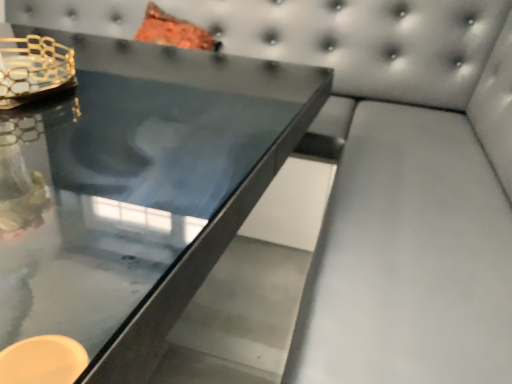
Question: Is glossy glass table at center in front of gold mesh candle holder at upper left?

Choices:
 (A) yes
 (B) no

Answer: (A)

Question: Can you confirm if glossy glass table at center is positioned to the left of gold mesh candle holder at upper left?

Choices:
 (A) no
 (B) yes

Answer: (A)

Question: From the image's perspective, is glossy glass table at center located above gold mesh candle holder at upper left?

Choices:
 (A) yes
 (B) no

Answer: (B)

Question: Does glossy glass table at center have a smaller size compared to gold mesh candle holder at upper left?

Choices:
 (A) no
 (B) yes

Answer: (A)

Question: Would you say glossy glass table at center is outside gold mesh candle holder at upper left?

Choices:
 (A) yes
 (B) no

Answer: (A)

Question: Is glossy glass table at center next to gold mesh candle holder at upper left and touching it?

Choices:
 (A) yes
 (B) no

Answer: (B)

Question: Does gold mesh candle holder at upper left lie in front of glossy glass table at center?

Choices:
 (A) yes
 (B) no

Answer: (B)

Question: Is gold mesh candle holder at upper left to the left of glossy glass table at center from the viewer's perspective?

Choices:
 (A) yes
 (B) no

Answer: (A)

Question: Is gold mesh candle holder at upper left facing towards glossy glass table at center?

Choices:
 (A) no
 (B) yes

Answer: (A)

Question: From the image's perspective, is gold mesh candle holder at upper left under glossy glass table at center?

Choices:
 (A) yes
 (B) no

Answer: (B)

Question: Is gold mesh candle holder at upper left taller than glossy glass table at center?

Choices:
 (A) no
 (B) yes

Answer: (A)

Question: Is gold mesh candle holder at upper left to the right of glossy glass table at center from the viewer's perspective?

Choices:
 (A) yes
 (B) no

Answer: (B)

Question: Is glossy glass table at center inside or outside of gold mesh candle holder at upper left?

Choices:
 (A) inside
 (B) outside

Answer: (B)